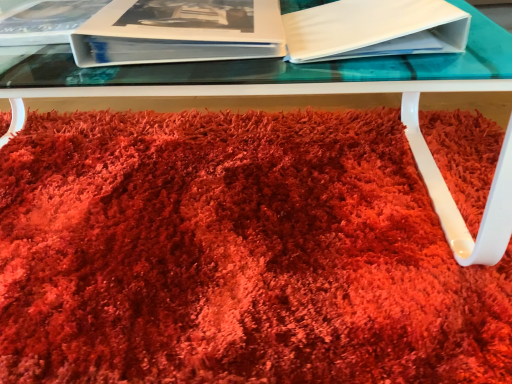
Describe the element at coordinates (42, 20) in the screenshot. I see `white glossy album at upper left` at that location.

What is the approximate height of white glossy album at upper left?

It is 1.09 inches.

Identify the location of shaggy red carpet at center. (234, 255).

Would you say white glossy book at upper left, acting as the first paperback book starting from the left, is to the left or to the right of white glossy album at upper left in the picture?

white glossy book at upper left, acting as the first paperback book starting from the left, is to the right of white glossy album at upper left.

Choose the correct answer: Is white glossy book at upper left, acting as the first paperback book starting from the left, inside white glossy album at upper left or outside it?

white glossy book at upper left, acting as the first paperback book starting from the left, is not inside white glossy album at upper left, it's outside.

From their relative heights in the image, would you say white glossy book at upper left, acting as the first paperback book starting from the left, is taller or shorter than white glossy album at upper left?

Considering their sizes, white glossy book at upper left, acting as the first paperback book starting from the left, has more height than white glossy album at upper left.

From a real-world perspective, is white glossy book at upper left, the second paperback book viewed from the right, physically above white glossy album at upper left?

Yes, from a real-world perspective, white glossy book at upper left, the second paperback book viewed from the right, is on top of white glossy album at upper left.

Can you confirm if shaggy red carpet at center is taller than white matte book at upper right, which is the second paperback book in left-to-right order?

No, shaggy red carpet at center is not taller than white matte book at upper right, which is the second paperback book in left-to-right order.

From the image's perspective, is shaggy red carpet at center below white matte book at upper right, which is the second paperback book in left-to-right order?

Yes, from the image's perspective, shaggy red carpet at center is beneath white matte book at upper right, which is the second paperback book in left-to-right order.

You are a GUI agent. You are given a task and a screenshot of the screen. Output one action in this format:
    pyautogui.click(x=<x>, y=<y>)
    Task: Click on the 1st paperback book positioned above the shaggy red carpet at center (from the image's perspective)
    
    Given the screenshot: What is the action you would take?
    pyautogui.click(x=374, y=29)

How far apart are shaggy red carpet at center and white matte book at upper right, the 1th paperback book from the right?

15.39 inches.

Is white matte book at upper right, which is the second paperback book in left-to-right order, not within white glossy book at upper left, the second paperback book viewed from the right?

Absolutely, white matte book at upper right, which is the second paperback book in left-to-right order, is external to white glossy book at upper left, the second paperback book viewed from the right.

Is white matte book at upper right, the 1th paperback book from the right, next to white glossy book at upper left, acting as the first paperback book starting from the left, and touching it?

No, white matte book at upper right, the 1th paperback book from the right, is not touching white glossy book at upper left, acting as the first paperback book starting from the left.

Could you measure the distance between white matte book at upper right, the 1th paperback book from the right, and white glossy book at upper left, acting as the first paperback book starting from the left?

5.10 inches.

From the image's perspective, is white matte book at upper right, which is the second paperback book in left-to-right order, over white glossy book at upper left, the second paperback book viewed from the right?

No, from the image's perspective, white matte book at upper right, which is the second paperback book in left-to-right order, is not above white glossy book at upper left, the second paperback book viewed from the right.

Does point (4, 42) appear closer or farther from the camera than point (133, 55)?

Clearly, point (4, 42) is more distant from the camera than point (133, 55).

In the image, is white glossy album at upper left positioned in front of or behind white glossy book at upper left, the second paperback book viewed from the right?

Clearly, white glossy album at upper left is behind white glossy book at upper left, the second paperback book viewed from the right.

Visually, is white glossy album at upper left positioned to the left or to the right of white glossy book at upper left, acting as the first paperback book starting from the left?

Based on their positions, white glossy album at upper left is located to the left of white glossy book at upper left, acting as the first paperback book starting from the left.

Does white glossy album at upper left have a lesser width compared to white glossy book at upper left, the second paperback book viewed from the right?

Indeed, white glossy album at upper left has a lesser width compared to white glossy book at upper left, the second paperback book viewed from the right.

Is shaggy red carpet at center completely or partially outside of white glossy book at upper left, the second paperback book viewed from the right?

Yes, shaggy red carpet at center is not within white glossy book at upper left, the second paperback book viewed from the right.

In terms of width, does shaggy red carpet at center look wider or thinner when compared to white glossy book at upper left, acting as the first paperback book starting from the left?

Clearly, shaggy red carpet at center has more width compared to white glossy book at upper left, acting as the first paperback book starting from the left.

From the picture: Is shaggy red carpet at center not near white glossy book at upper left, acting as the first paperback book starting from the left?

Actually, shaggy red carpet at center and white glossy book at upper left, acting as the first paperback book starting from the left, are a little close together.

Is white glossy album at upper left not inside white matte book at upper right, which is the second paperback book in left-to-right order?

That's correct, white glossy album at upper left is outside of white matte book at upper right, which is the second paperback book in left-to-right order.

Looking at this image, is white glossy album at upper left looking in the opposite direction of white matte book at upper right, which is the second paperback book in left-to-right order?

white glossy album at upper left does not have its back to white matte book at upper right, which is the second paperback book in left-to-right order.

Considering the relative sizes of white glossy album at upper left and white matte book at upper right, which is the second paperback book in left-to-right order, in the image provided, is white glossy album at upper left taller than white matte book at upper right, which is the second paperback book in left-to-right order,?

Incorrect, the height of white glossy album at upper left is not larger of that of white matte book at upper right, which is the second paperback book in left-to-right order.

What's the angular difference between white glossy album at upper left and white matte book at upper right, which is the second paperback book in left-to-right order,'s facing directions?

They differ by 4.52 degrees in their facing directions.

Image resolution: width=512 pixels, height=384 pixels. What are the coordinates of `paperback book lying below the white glossy book at upper left, the second paperback book viewed from the right (from the image's perspective)` in the screenshot? It's located at (374, 29).

Can white matte book at upper right, which is the second paperback book in left-to-right order, be found inside white glossy book at upper left, the second paperback book viewed from the right?

No, white glossy book at upper left, the second paperback book viewed from the right, does not contain white matte book at upper right, which is the second paperback book in left-to-right order.

How many degrees apart are the facing directions of white glossy book at upper left, acting as the first paperback book starting from the left, and white matte book at upper right, which is the second paperback book in left-to-right order?

The angular difference between white glossy book at upper left, acting as the first paperback book starting from the left, and white matte book at upper right, which is the second paperback book in left-to-right order, is 1.46 degrees.

Which is more to the right, white glossy book at upper left, acting as the first paperback book starting from the left, or white matte book at upper right, which is the second paperback book in left-to-right order?

Positioned to the right is white matte book at upper right, which is the second paperback book in left-to-right order.

Which paperback book is the 1st one when counting from the front of the white glossy album at upper left? Please provide its 2D coordinates.

[(179, 32)]

The height and width of the screenshot is (384, 512). What are the coordinates of `the 2nd paperback book located above the shaggy red carpet at center (from a real-world perspective)` in the screenshot? It's located at 374,29.

When comparing their distances from shaggy red carpet at center, does white glossy book at upper left, the second paperback book viewed from the right, or white glossy album at upper left seem further?

white glossy album at upper left.

From the image, which object appears to be farther from white glossy album at upper left, white glossy book at upper left, acting as the first paperback book starting from the left, or shaggy red carpet at center?

shaggy red carpet at center lies further to white glossy album at upper left than the other object.

Considering their positions, is white glossy album at upper left positioned closer to white matte book at upper right, the 1th paperback book from the right, than white glossy book at upper left, the second paperback book viewed from the right?

white glossy book at upper left, the second paperback book viewed from the right, is positioned closer to the anchor white matte book at upper right, the 1th paperback book from the right.

From the image, which object appears to be farther from shaggy red carpet at center, white matte book at upper right, the 1th paperback book from the right, or white glossy album at upper left?

white glossy album at upper left is positioned further to the anchor shaggy red carpet at center.

Which object lies nearer to the anchor point white matte book at upper right, which is the second paperback book in left-to-right order, shaggy red carpet at center or white glossy album at upper left?

shaggy red carpet at center is closer to white matte book at upper right, which is the second paperback book in left-to-right order.

Looking at the image, which one is located closer to white glossy album at upper left, white matte book at upper right, which is the second paperback book in left-to-right order, or shaggy red carpet at center?

white matte book at upper right, which is the second paperback book in left-to-right order.

Based on their spatial positions, is shaggy red carpet at center or white glossy book at upper left, acting as the first paperback book starting from the left, closer to white glossy album at upper left?

white glossy book at upper left, acting as the first paperback book starting from the left, is closer to white glossy album at upper left.

Looking at the image, which one is located closer to shaggy red carpet at center, white glossy album at upper left or white glossy book at upper left, acting as the first paperback book starting from the left?

white glossy book at upper left, acting as the first paperback book starting from the left.

Locate an element on the screen. Image resolution: width=512 pixels, height=384 pixels. blanket between white glossy album at upper left and white matte book at upper right, the 1th paperback book from the right, in the horizontal direction is located at coordinates (234, 255).

The height and width of the screenshot is (384, 512). In order to click on paperback book between white glossy book at upper left, the second paperback book viewed from the right, and shaggy red carpet at center from top to bottom in this screenshot , I will do `click(374, 29)`.

The width and height of the screenshot is (512, 384). I want to click on paperback book between white glossy album at upper left and white matte book at upper right, which is the second paperback book in left-to-right order, so click(179, 32).